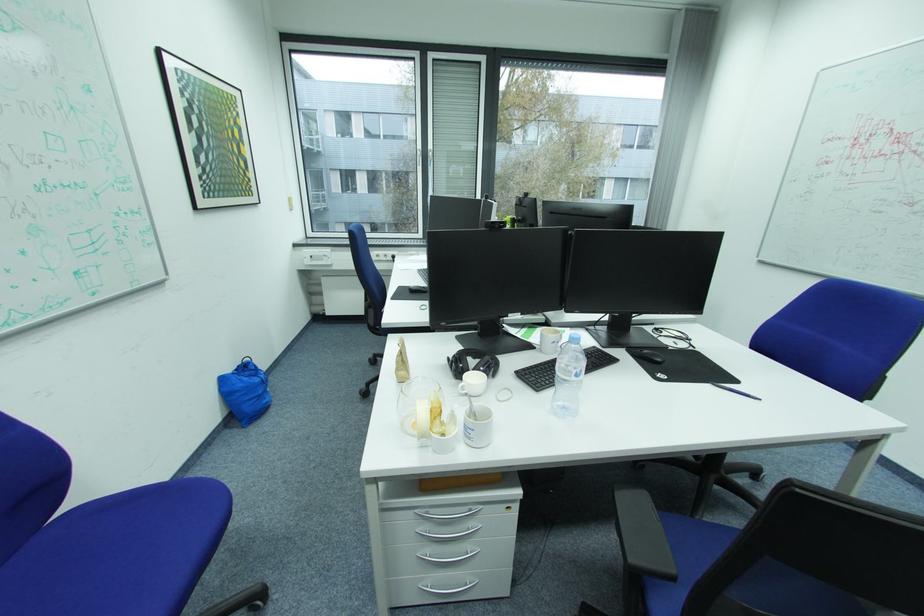
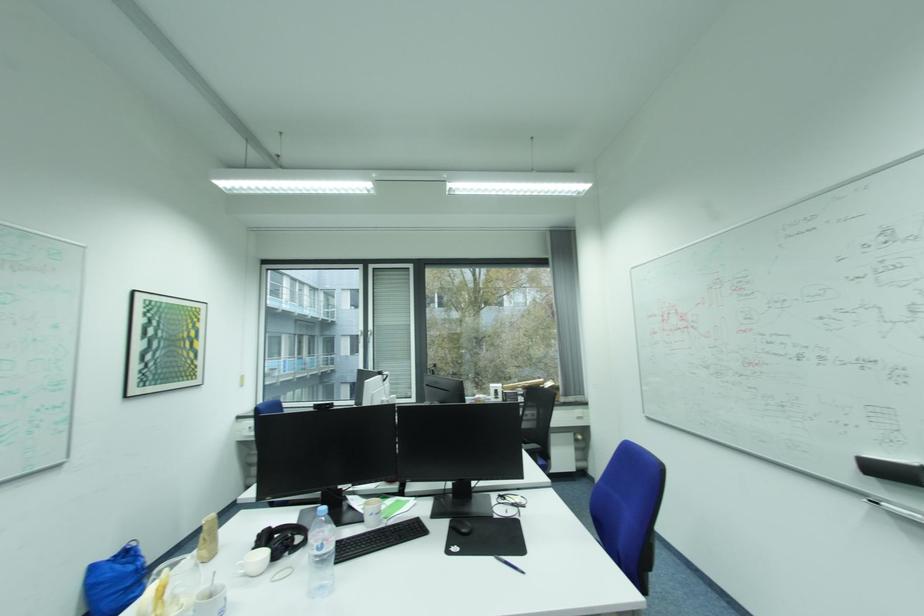
Locate, in the second image, the point that corresponds to pixel 495 370 in the first image.

(287, 546)